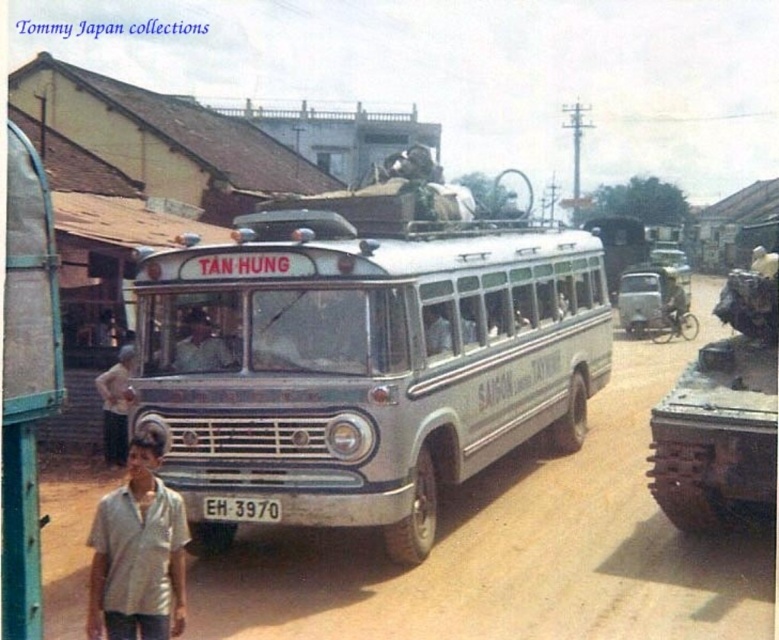
Consider the image. Can you confirm if rusty metal tank at right is positioned to the left of light beige shirt at lower left?

In fact, rusty metal tank at right is to the right of light beige shirt at lower left.

Can you confirm if rusty metal tank at right is wider than light beige shirt at lower left?

Indeed, rusty metal tank at right has a greater width compared to light beige shirt at lower left.

Which is in front, point (735, 342) or point (108, 516)?

Point (108, 516)

Locate an element on the screen. rusty metal tank at right is located at coordinates (721, 412).

Can you confirm if light beige shirt at lower left is bigger than white plastic license plate at center?

Yes.

Is light beige shirt at lower left below white plastic license plate at center?

No, light beige shirt at lower left is not below white plastic license plate at center.

The height and width of the screenshot is (640, 779). In order to click on light beige shirt at lower left in this screenshot , I will do `click(138, 550)`.

Locate an element on the screen. This screenshot has width=779, height=640. light beige shirt at lower left is located at coordinates (138, 550).

Which of these two, brown dirt track at center or white plastic license plate at center, stands shorter?

With less height is white plastic license plate at center.

Can you confirm if brown dirt track at center is shorter than white plastic license plate at center?

No, brown dirt track at center is not shorter than white plastic license plate at center.

Between point (73, 545) and point (245, 508), which one is positioned in front?

Positioned in front is point (245, 508).

I want to click on brown dirt track at center, so 513,548.